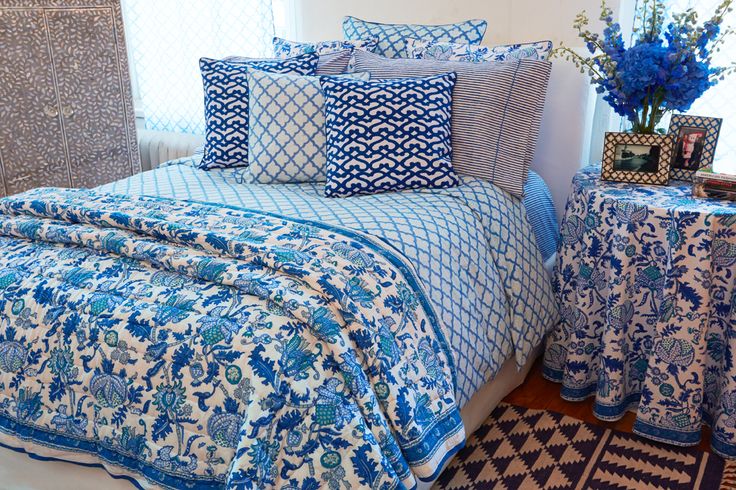
Locate an element on the screen. The width and height of the screenshot is (736, 490). white wall is located at coordinates (537, 13).